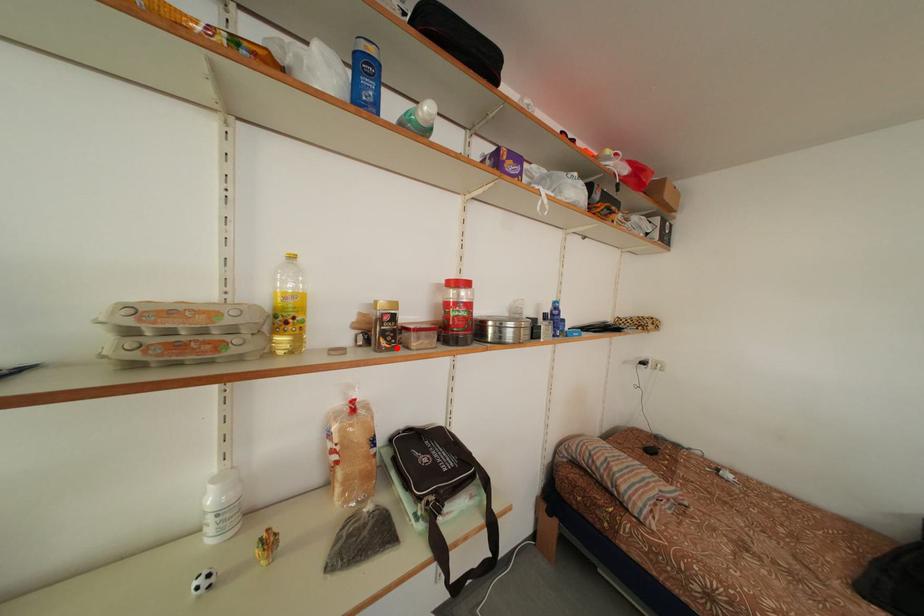
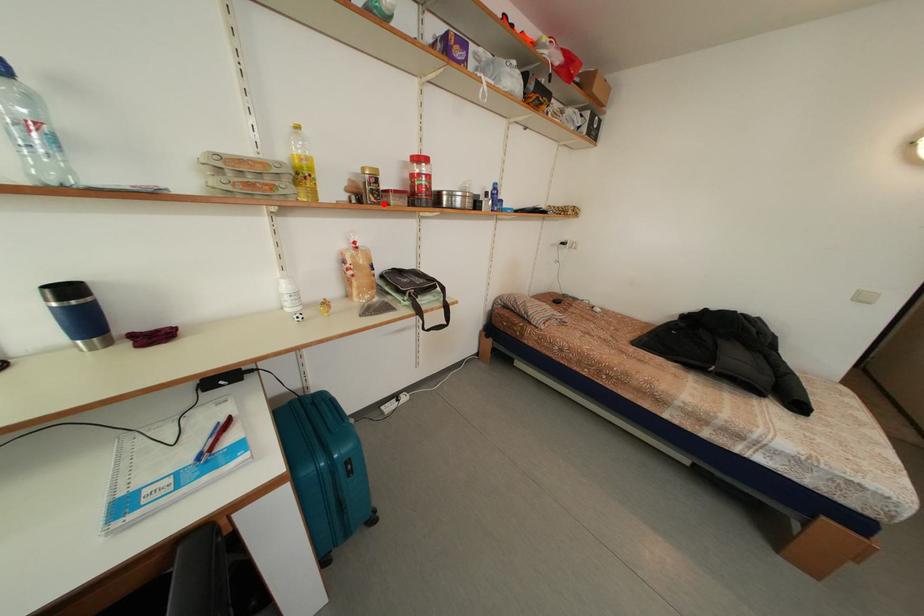
Based on the photo, I am providing you with two images of the same scene from different viewpoints. A red point is marked on the first image and another point is marked on the second image. Is the marked point in image1 the same physical position as the marked point in image2?

Yes